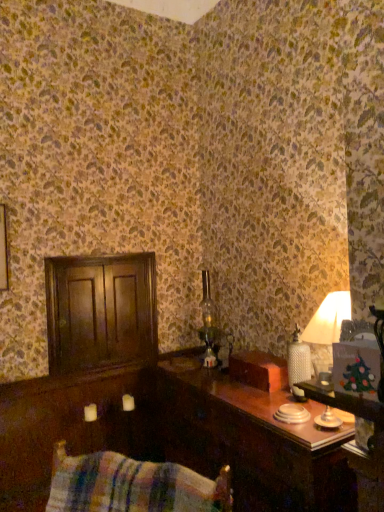
Question: Is the depth of dark wood dresser at left less than that of plaid fabric swivel chair at lower left?

Choices:
 (A) no
 (B) yes

Answer: (A)

Question: Is dark wood dresser at left to the right of plaid fabric swivel chair at lower left from the viewer's perspective?

Choices:
 (A) no
 (B) yes

Answer: (A)

Question: Can you confirm if dark wood dresser at left is smaller than plaid fabric swivel chair at lower left?

Choices:
 (A) yes
 (B) no

Answer: (A)

Question: Is dark wood dresser at left positioned far away from plaid fabric swivel chair at lower left?

Choices:
 (A) no
 (B) yes

Answer: (B)

Question: From a real-world perspective, is dark wood dresser at left beneath plaid fabric swivel chair at lower left?

Choices:
 (A) no
 (B) yes

Answer: (A)

Question: In terms of width, does wooden table at right look wider or thinner when compared to dark wood dresser at left?

Choices:
 (A) thin
 (B) wide

Answer: (B)

Question: Choose the correct answer: Is wooden table at right inside dark wood dresser at left or outside it?

Choices:
 (A) outside
 (B) inside

Answer: (A)

Question: Is wooden table at right in front of or behind dark wood dresser at left in the image?

Choices:
 (A) front
 (B) behind

Answer: (A)

Question: From a real-world perspective, relative to dark wood dresser at left, is wooden table at right vertically above or below?

Choices:
 (A) below
 (B) above

Answer: (A)

Question: From the image's perspective, is dark wood dresser at left positioned above or below wooden table at right?

Choices:
 (A) above
 (B) below

Answer: (A)

Question: Based on their positions, is dark wood dresser at left located to the left or right of wooden table at right?

Choices:
 (A) left
 (B) right

Answer: (A)

Question: In terms of height, does dark wood dresser at left look taller or shorter compared to wooden table at right?

Choices:
 (A) tall
 (B) short

Answer: (B)

Question: Considering their positions, is dark wood dresser at left located in front of or behind wooden table at right?

Choices:
 (A) behind
 (B) front

Answer: (A)

Question: Considering their positions, is plaid fabric swivel chair at lower left located in front of or behind dark wood dresser at left?

Choices:
 (A) front
 (B) behind

Answer: (A)

Question: Visually, is plaid fabric swivel chair at lower left positioned to the left or to the right of dark wood dresser at left?

Choices:
 (A) right
 (B) left

Answer: (A)